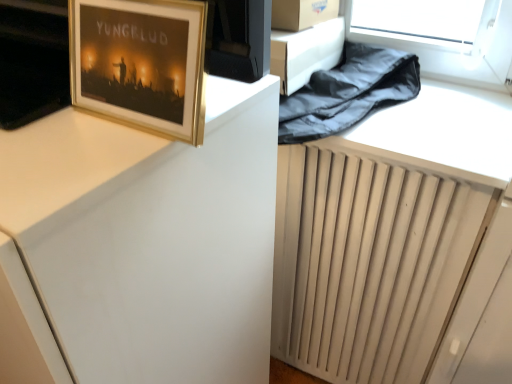
Question: From a real-world perspective, does white matte computer desk at upper left stand above gold-framed picture at upper left?

Choices:
 (A) yes
 (B) no

Answer: (B)

Question: Does white matte computer desk at upper left have a lesser height compared to gold-framed picture at upper left?

Choices:
 (A) no
 (B) yes

Answer: (A)

Question: Does white matte computer desk at upper left have a greater height compared to gold-framed picture at upper left?

Choices:
 (A) no
 (B) yes

Answer: (B)

Question: Is white matte computer desk at upper left to the right of gold-framed picture at upper left from the viewer's perspective?

Choices:
 (A) no
 (B) yes

Answer: (A)

Question: Considering the relative sizes of white matte computer desk at upper left and gold-framed picture at upper left in the image provided, is white matte computer desk at upper left bigger than gold-framed picture at upper left?

Choices:
 (A) yes
 (B) no

Answer: (A)

Question: From the image's perspective, is white matte computer desk at upper left located beneath gold-framed picture at upper left?

Choices:
 (A) yes
 (B) no

Answer: (A)

Question: From the image's perspective, is gold-framed picture at upper left located above white matte computer desk at upper left?

Choices:
 (A) no
 (B) yes

Answer: (B)

Question: Does gold-framed picture at upper left have a lesser height compared to white matte computer desk at upper left?

Choices:
 (A) no
 (B) yes

Answer: (B)

Question: From a real-world perspective, is gold-framed picture at upper left positioned under white matte computer desk at upper left based on gravity?

Choices:
 (A) yes
 (B) no

Answer: (B)

Question: From a real-world perspective, does gold-framed picture at upper left stand above white matte computer desk at upper left?

Choices:
 (A) no
 (B) yes

Answer: (B)

Question: Is gold-framed picture at upper left not within white matte computer desk at upper left?

Choices:
 (A) no
 (B) yes

Answer: (B)

Question: Considering the relative positions of gold-framed picture at upper left and white matte computer desk at upper left in the image provided, is gold-framed picture at upper left to the left of white matte computer desk at upper left from the viewer's perspective?

Choices:
 (A) no
 (B) yes

Answer: (A)

Question: From the image's perspective, is gold-framed picture at upper left located above or below white matte computer desk at upper left?

Choices:
 (A) above
 (B) below

Answer: (A)